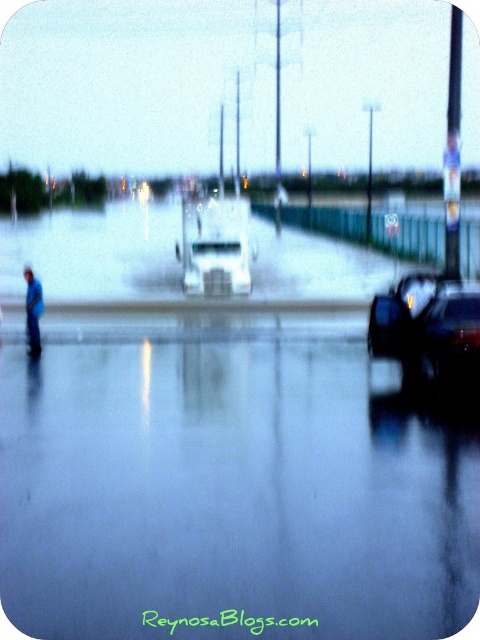
You are driving a car and see the glossy reflective water at lower center and the blue fabric person at left. Which object is closer to you as you approach the flooded road?

The glossy reflective water at lower center is positioned under the blue fabric person at left, meaning it is closer to you since it is beneath the person in the scene.

Based on the photo, you are a pedestrian trying to cross the flooded road. You see the glossy reflective water at lower center and the blue fabric person at left. Which object is closer to you?

The glossy reflective water at lower center is closer to the viewer than the blue fabric person at left.

You are a pedestrian trying to cross the flooded road. You see the shiny black car at lower right and the blue fabric person at left. Which object is shorter in height?

The shiny black car at lower right is not as tall as the blue fabric person at left, so the shiny black car at lower right is shorter in height.